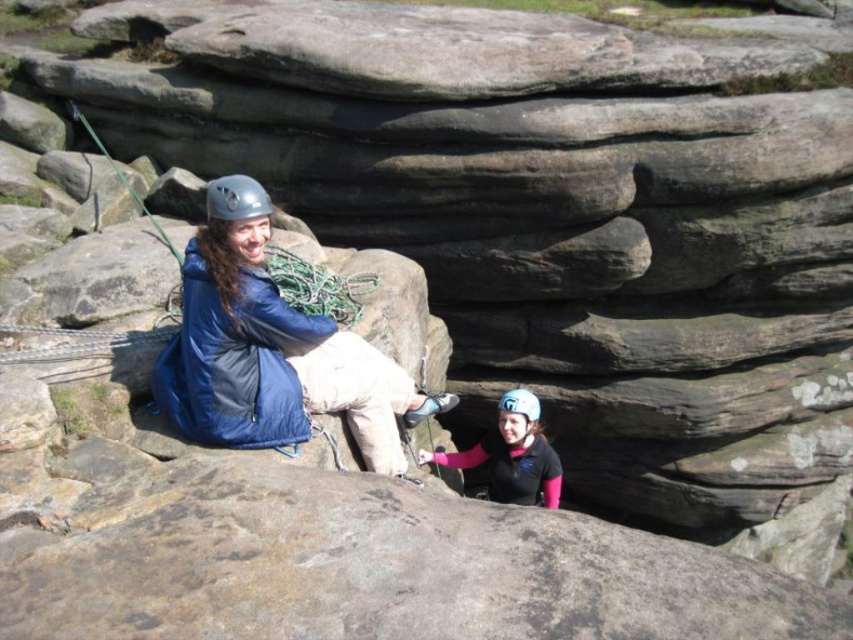
Question: Does metallic gray helmet at upper center have a greater width compared to white matte helmet at lower center?

Choices:
 (A) yes
 (B) no

Answer: (A)

Question: Which object is farther from the camera taking this photo?

Choices:
 (A) blue synthetic jacket at upper left
 (B) metallic gray helmet at upper center
 (C) white matte helmet at lower center
 (D) matte white helmet at center

Answer: (C)

Question: Is blue synthetic jacket at upper left thinner than metallic gray helmet at upper center?

Choices:
 (A) yes
 (B) no

Answer: (B)

Question: Is blue synthetic jacket at upper left positioned behind metallic gray helmet at upper center?

Choices:
 (A) yes
 (B) no

Answer: (B)

Question: Which of these objects is positioned farthest from the blue synthetic jacket at upper left?

Choices:
 (A) matte white helmet at center
 (B) white matte helmet at lower center
 (C) metallic gray helmet at upper center

Answer: (B)

Question: Which of the following is the closest to the observer?

Choices:
 (A) click(260, 401)
 (B) click(265, 204)

Answer: (B)